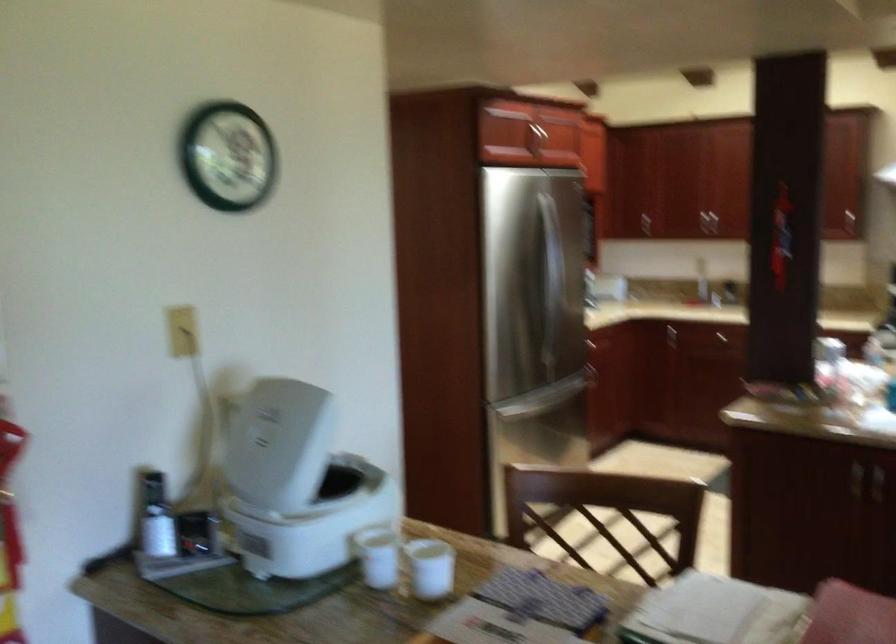
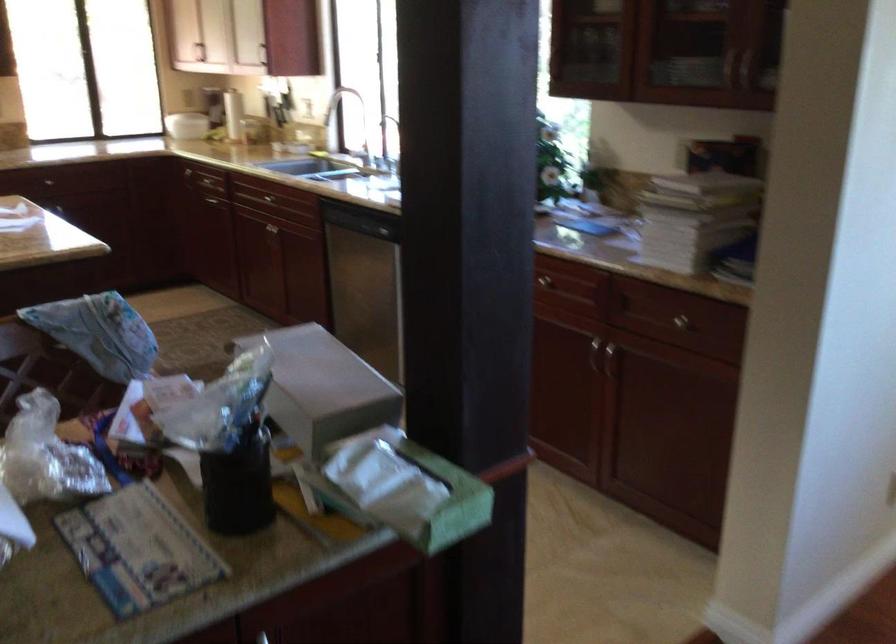
Question: How did the camera likely rotate?

Choices:
 (A) Left
 (B) Right
 (C) Up
 (D) Down

Answer: (B)